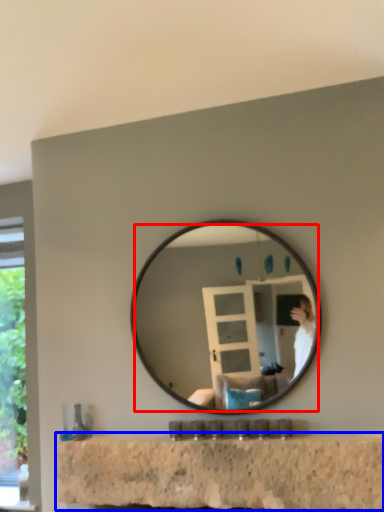
Question: Among these objects, which one is farthest to the camera, mirror (highlighted by a red box) or counter top (highlighted by a blue box)?

Choices:
 (A) mirror
 (B) counter top

Answer: (A)